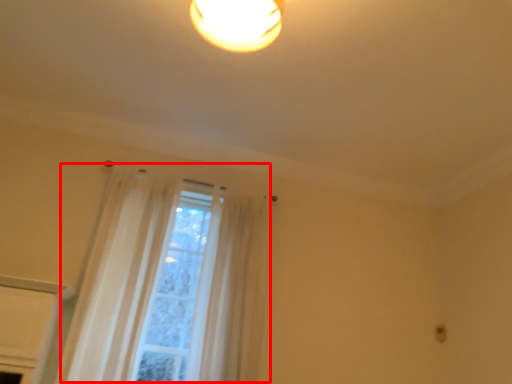
Question: From the image's perspective, where is curtain (annotated by the red box) located relative to curtain?

Choices:
 (A) above
 (B) below

Answer: (A)